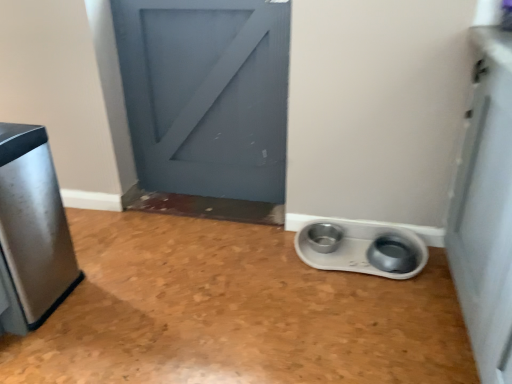
Question: Considering the positions of brushed metal trash can at left and white plastic pet bowls at lower right in the image, is brushed metal trash can at left wider or thinner than white plastic pet bowls at lower right?

Choices:
 (A) thin
 (B) wide

Answer: (B)

Question: Considering the positions of brushed metal trash can at left and white plastic pet bowls at lower right in the image, is brushed metal trash can at left taller or shorter than white plastic pet bowls at lower right?

Choices:
 (A) tall
 (B) short

Answer: (A)

Question: From a real-world perspective, is brushed metal trash can at left positioned above or below white plastic pet bowls at lower right?

Choices:
 (A) below
 (B) above

Answer: (B)

Question: Considering the positions of point (315, 244) and point (0, 218), is point (315, 244) closer or farther from the camera than point (0, 218)?

Choices:
 (A) farther
 (B) closer

Answer: (A)

Question: Considering the positions of white plastic pet bowls at lower right and brushed metal trash can at left in the image, is white plastic pet bowls at lower right bigger or smaller than brushed metal trash can at left?

Choices:
 (A) small
 (B) big

Answer: (A)

Question: Is white plastic pet bowls at lower right taller or shorter than brushed metal trash can at left?

Choices:
 (A) tall
 (B) short

Answer: (B)

Question: Is white plastic pet bowls at lower right in front of or behind brushed metal trash can at left in the image?

Choices:
 (A) front
 (B) behind

Answer: (B)